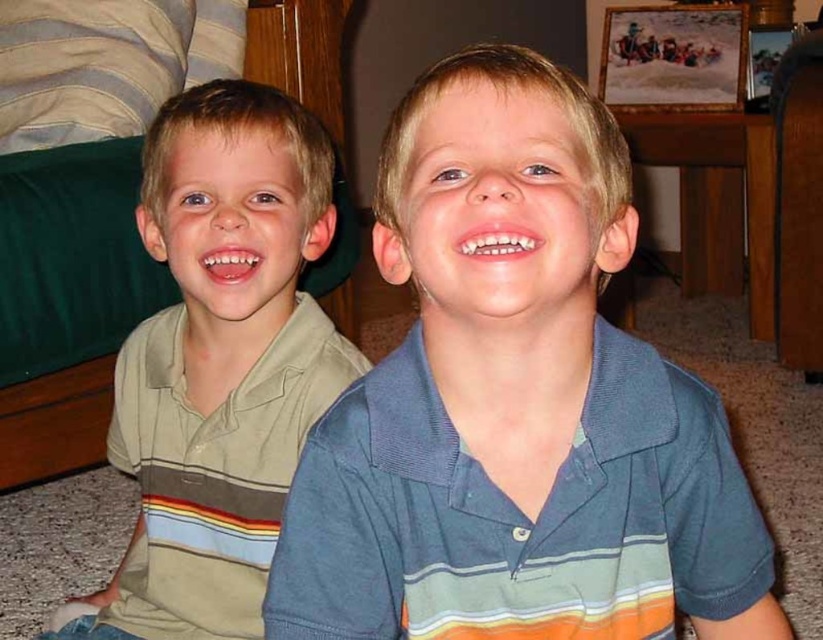
Does blue striped polo shirt at center have a smaller size compared to light brown striped polo shirt at left?

Indeed, blue striped polo shirt at center has a smaller size compared to light brown striped polo shirt at left.

This screenshot has height=640, width=823. What do you see at coordinates (515, 404) in the screenshot? I see `blue striped polo shirt at center` at bounding box center [515, 404].

This screenshot has height=640, width=823. What do you see at coordinates (515, 404) in the screenshot? I see `blue striped polo shirt at center` at bounding box center [515, 404].

At what (x,y) coordinates should I click in order to perform the action: click on blue striped polo shirt at center. Please return your answer as a coordinate pair (x, y). This screenshot has width=823, height=640. Looking at the image, I should click on (515, 404).